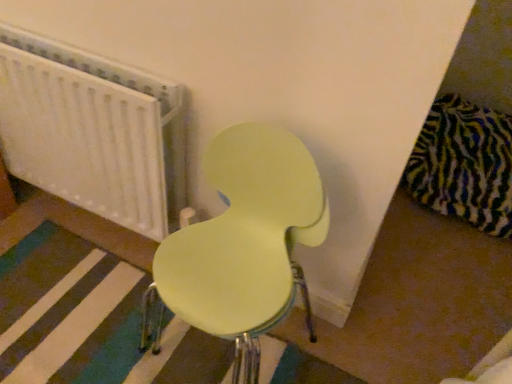
Question: Is white textured radiator at upper left smaller than matte yellow chair at center?

Choices:
 (A) yes
 (B) no

Answer: (A)

Question: Does white textured radiator at upper left have a greater width compared to matte yellow chair at center?

Choices:
 (A) no
 (B) yes

Answer: (A)

Question: From a real-world perspective, is white textured radiator at upper left located beneath matte yellow chair at center?

Choices:
 (A) no
 (B) yes

Answer: (B)

Question: Is white textured radiator at upper left further to camera compared to matte yellow chair at center?

Choices:
 (A) yes
 (B) no

Answer: (A)

Question: Is white textured radiator at upper left to the left of matte yellow chair at center from the viewer's perspective?

Choices:
 (A) no
 (B) yes

Answer: (B)

Question: Is white textured radiator at upper left directly adjacent to matte yellow chair at center?

Choices:
 (A) yes
 (B) no

Answer: (B)

Question: Is matte yellow chair at center directly adjacent to white textured radiator at upper left?

Choices:
 (A) no
 (B) yes

Answer: (A)

Question: Is matte yellow chair at center not inside white textured radiator at upper left?

Choices:
 (A) no
 (B) yes

Answer: (B)

Question: Is the depth of matte yellow chair at center less than that of white textured radiator at upper left?

Choices:
 (A) no
 (B) yes

Answer: (B)

Question: Does matte yellow chair at center turn towards white textured radiator at upper left?

Choices:
 (A) no
 (B) yes

Answer: (A)

Question: From the image's perspective, is matte yellow chair at center above white textured radiator at upper left?

Choices:
 (A) no
 (B) yes

Answer: (A)

Question: Is matte yellow chair at center turned away from white textured radiator at upper left?

Choices:
 (A) no
 (B) yes

Answer: (A)

Question: Is point (129, 183) closer or farther from the camera than point (296, 230)?

Choices:
 (A) closer
 (B) farther

Answer: (B)